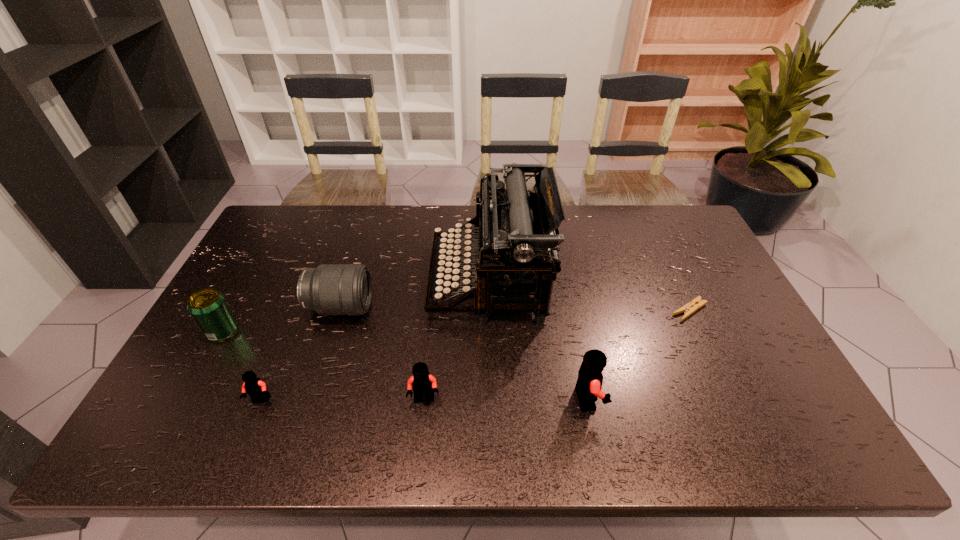
Find the location of a particular element. Image resolution: width=960 pixels, height=540 pixels. vacant space situated 0.130m on the front-facing side of the second tallest object is located at coordinates (657, 399).

Locate an element on the screen. free space located 0.380m on the typing side of the typewriter is located at coordinates (308, 280).

I want to click on blank space located on the typing side of the typewriter, so click(347, 280).

Identify the location of free region located on the typing side of the typewriter. (318, 280).

Find the location of `vacant space located 0.200m on the surface of the telephoto lens`. vacant space located 0.200m on the surface of the telephoto lens is located at coordinates (440, 307).

At what (x,y) coordinates should I click in order to perform the action: click on vacant space located on the left of the rightmost object. Please return your answer as a coordinate pair (x, y). Looking at the image, I should click on (617, 310).

At what (x,y) coordinates should I click in order to perform the action: click on free point located 0.290m on the right of the beer can. Please return your answer as a coordinate pair (x, y). Looking at the image, I should click on (344, 332).

I want to click on object that is positioned at the far edge, so click(x=512, y=225).

Locate an element on the screen. The height and width of the screenshot is (540, 960). object located at the left edge is located at coordinates (208, 307).

Locate an element on the screen. The image size is (960, 540). object that is positioned at the right edge is located at coordinates (691, 307).